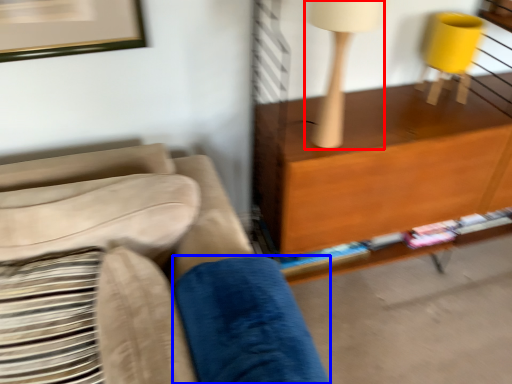
Question: Among these objects, which one is nearest to the camera, table lamp (highlighted by a red box) or pillow (highlighted by a blue box)?

Choices:
 (A) table lamp
 (B) pillow

Answer: (B)